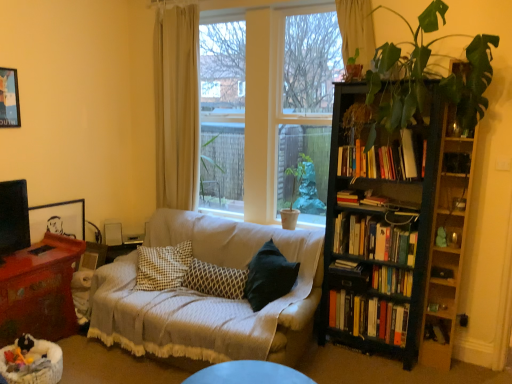
Question: Is beige fabric curtain at upper center, placed as the 1th curtain when sorted from right to left, at the back of hardcover book at center-right, the third book ordered from the bottom?

Choices:
 (A) no
 (B) yes

Answer: (A)

Question: Is hardcover book at center-right, the third book ordered from the bottom, located outside beige fabric curtain at upper center, placed as the 1th curtain when sorted from right to left?

Choices:
 (A) yes
 (B) no

Answer: (A)

Question: Does hardcover book at center-right, the third book ordered from the bottom, have a greater width compared to beige fabric curtain at upper center, placed as the 1th curtain when sorted from right to left?

Choices:
 (A) no
 (B) yes

Answer: (B)

Question: Is hardcover book at center-right, which is the 4th book from top to bottom, bigger than beige fabric curtain at upper center, the 2th curtain viewed from the left?

Choices:
 (A) no
 (B) yes

Answer: (A)

Question: Can you confirm if hardcover book at center-right, which is the 4th book from top to bottom, is smaller than beige fabric curtain at upper center, placed as the 1th curtain when sorted from right to left?

Choices:
 (A) yes
 (B) no

Answer: (A)

Question: Is hardcover book at center-right, the third book ordered from the bottom, directly adjacent to beige fabric curtain at upper center, placed as the 1th curtain when sorted from right to left?

Choices:
 (A) no
 (B) yes

Answer: (A)

Question: Can you confirm if hardcover books at right, arranged as the 4th book when ordered from the bottom, is positioned to the left of hardcover books at center-right, placed as the first book when sorted from top to bottom?

Choices:
 (A) yes
 (B) no

Answer: (B)

Question: From a real-world perspective, does hardcover books at right, arranged as the 4th book when ordered from the bottom, sit lower than hardcover books at center-right, placed as the 6th book when sorted from bottom to top?

Choices:
 (A) no
 (B) yes

Answer: (B)

Question: Would you say hardcover books at center-right, placed as the first book when sorted from top to bottom, is part of hardcover books at right, arranged as the 4th book when ordered from the bottom,'s contents?

Choices:
 (A) yes
 (B) no

Answer: (B)

Question: Does hardcover books at right, placed as the 3th book when sorted from top to bottom, turn towards hardcover books at center-right, placed as the first book when sorted from top to bottom?

Choices:
 (A) yes
 (B) no

Answer: (B)

Question: Is hardcover books at right, arranged as the 4th book when ordered from the bottom, far from hardcover books at center-right, placed as the 6th book when sorted from bottom to top?

Choices:
 (A) yes
 (B) no

Answer: (B)

Question: Does hardcover books at right, placed as the 3th book when sorted from top to bottom, come behind hardcover books at center-right, placed as the 6th book when sorted from bottom to top?

Choices:
 (A) no
 (B) yes

Answer: (B)

Question: Does hardcover book at center, the second book positioned from the top, have a greater height compared to patterned fabric pillow at center?

Choices:
 (A) no
 (B) yes

Answer: (A)